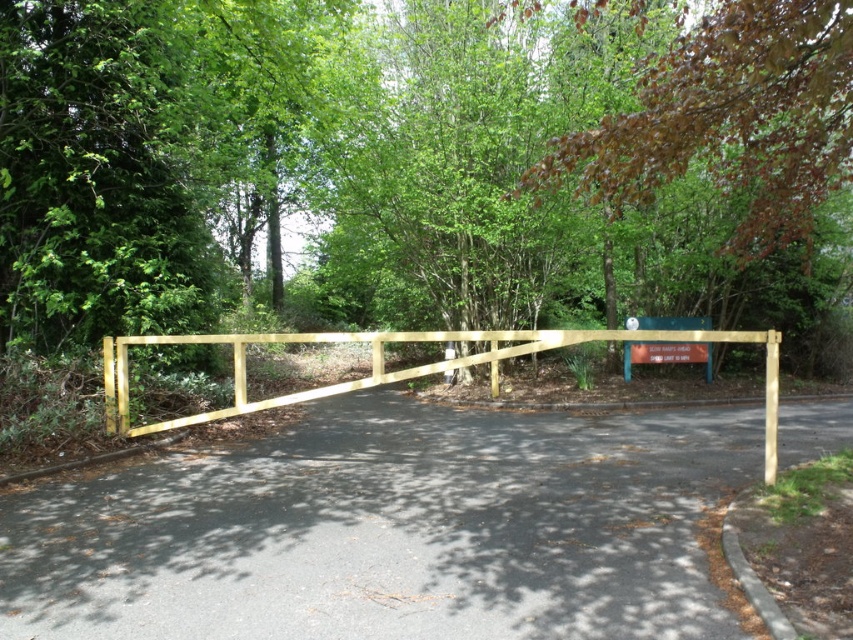
Question: Considering the real-world distances, which object is closest to the yellow wooden fence at center?

Choices:
 (A) blue painted wood sign at center
 (B) yellow wood fence at center
 (C) brown leafy tree at upper right
 (D) green wood fence at center

Answer: (B)

Question: Is green wood fence at center below yellow wood fence at center?

Choices:
 (A) no
 (B) yes

Answer: (A)

Question: Can you confirm if green wood fence at center is wider than brown leafy tree at upper right?

Choices:
 (A) no
 (B) yes

Answer: (B)

Question: Which point is farther from the camera taking this photo?

Choices:
 (A) (833, 84)
 (B) (645, 340)
 (C) (194, 420)

Answer: (B)

Question: Is brown leafy tree at upper right to the right of blue painted wood sign at center from the viewer's perspective?

Choices:
 (A) yes
 (B) no

Answer: (B)

Question: Which point is closer to the camera?

Choices:
 (A) yellow wooden fence at center
 (B) brown leafy tree at upper right

Answer: (A)